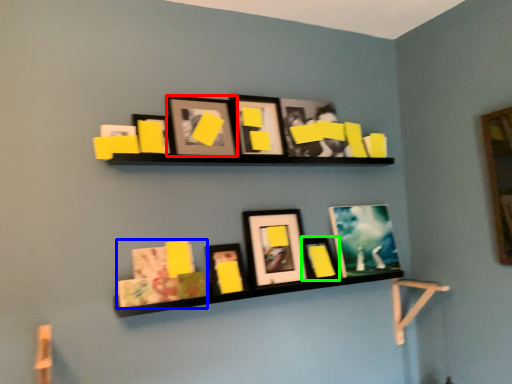
Question: Based on their relative distances, which object is farther from picture frame (highlighted by a red box)? Choose from book (highlighted by a blue box) and picture frame (highlighted by a green box).

Choices:
 (A) book
 (B) picture frame

Answer: (B)